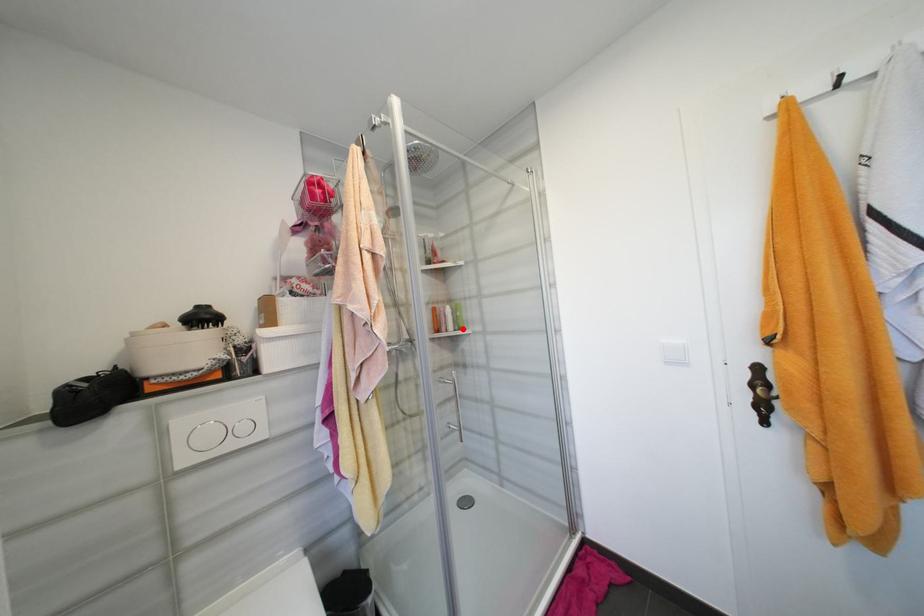
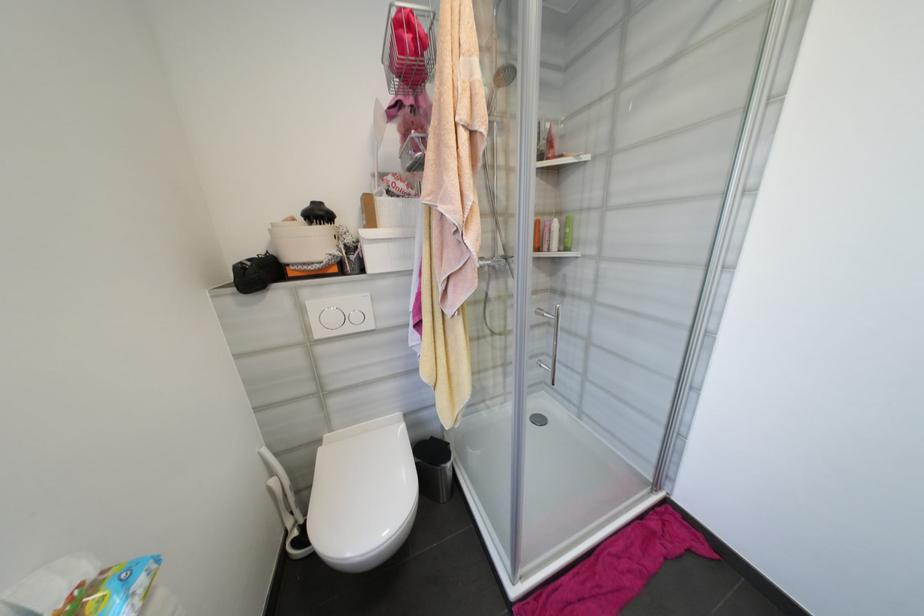
Locate, in the second image, the point that corresponds to the highlighted location in the first image.

(567, 249)